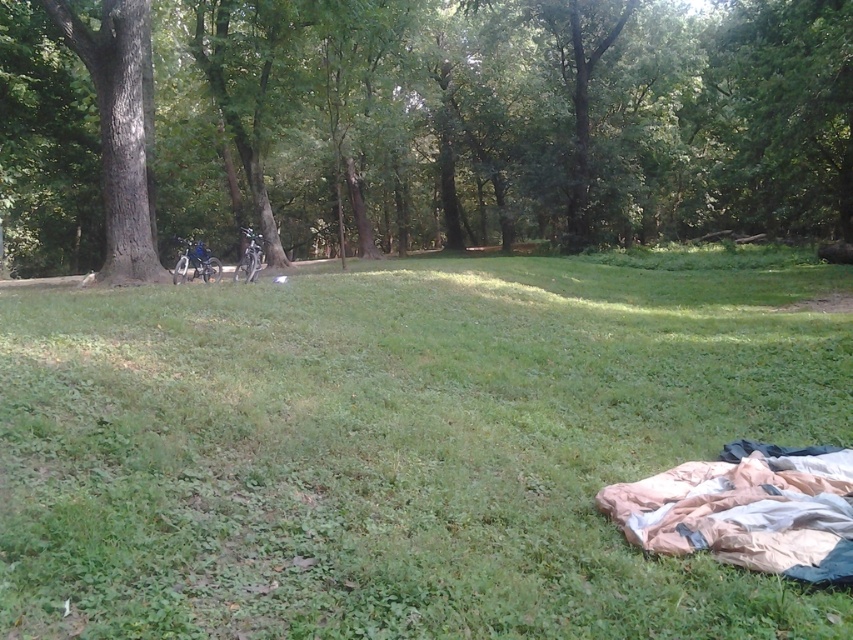
Where is `green leafy tree at center`? The height and width of the screenshot is (640, 853). green leafy tree at center is located at coordinates (415, 125).

Between green leafy tree at center and green rough bark tree at left, which one has less height?

green rough bark tree at left

Who is lower down, green leafy tree at center or green rough bark tree at left?

green rough bark tree at left is below.

Does point (131, 84) lie behind point (106, 3)?

Yes, it is behind point (106, 3).

This screenshot has height=640, width=853. Find the location of `green leafy tree at center`. green leafy tree at center is located at coordinates (415, 125).

Does green grassy at lower right have a larger size compared to green leafy tree at center?

No, green grassy at lower right is not bigger than green leafy tree at center.

The image size is (853, 640). What do you see at coordinates (399, 449) in the screenshot? I see `green grassy at lower right` at bounding box center [399, 449].

Describe the element at coordinates (399, 449) in the screenshot. The height and width of the screenshot is (640, 853). I see `green grassy at lower right` at that location.

Locate an element on the screen. green grassy at lower right is located at coordinates click(x=399, y=449).